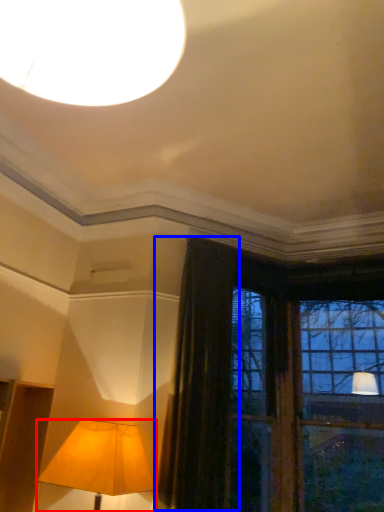
Question: Which object appears closest to the camera in this image, lamp (highlighted by a red box) or curtain (highlighted by a blue box)?

Choices:
 (A) lamp
 (B) curtain

Answer: (A)